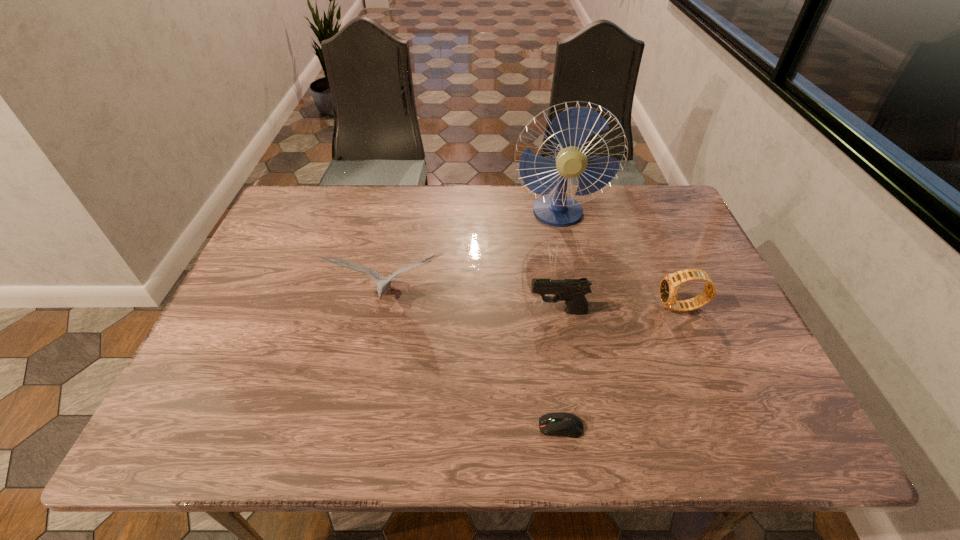
Locate an element on the screen. free space that satisfies the following two spatial constraints: 1. at the front of the tallest object where the blades are visible; 2. on the button of the shortest object is located at coordinates (602, 427).